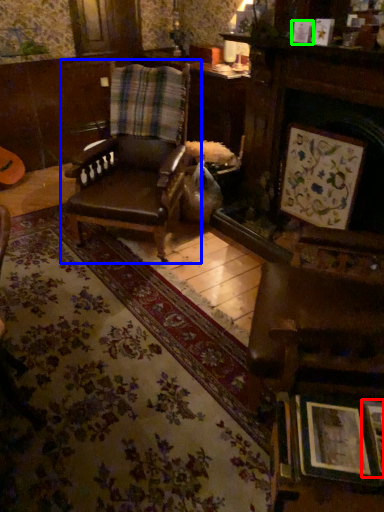
Question: Which object is positioned farthest from picture frame (highlighted by a red box)? Select from chair (highlighted by a blue box) and picture frame (highlighted by a green box).

Choices:
 (A) chair
 (B) picture frame

Answer: (A)